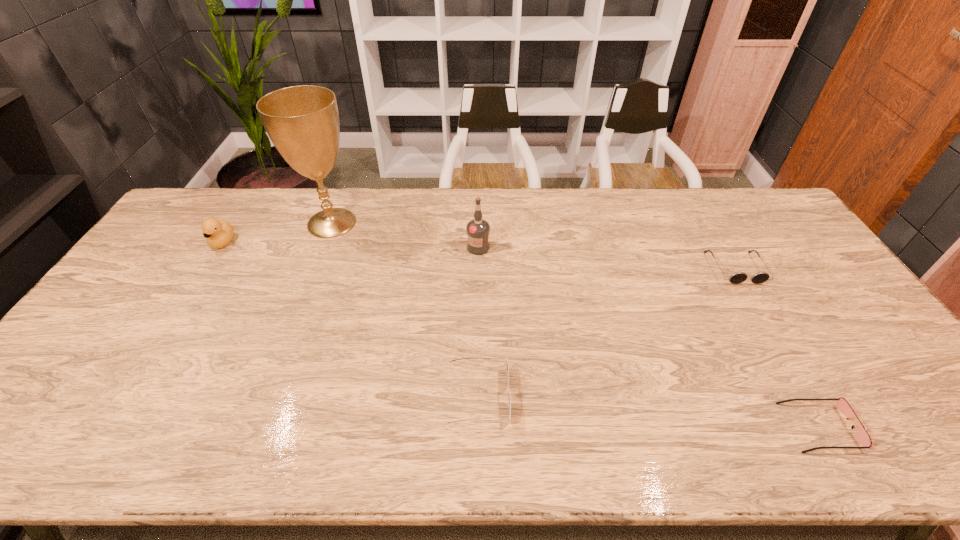
Where is `free spot between the leftmost sunglasses and the fifth object from right to left`? The height and width of the screenshot is (540, 960). free spot between the leftmost sunglasses and the fifth object from right to left is located at coordinates (405, 309).

I want to click on object that is the third closest to the vodka, so click(x=738, y=277).

Identify which object is the fifth closest to the leftmost sunglasses. Please provide its 2D coordinates. Your answer should be formatted as a tuple, i.e. [(x, y)], where the tuple contains the x and y coordinates of a point satisfying the conditions above.

[(218, 234)]

Locate which sunglasses ranks in proximity to the leftmost sunglasses. Please provide its 2D coordinates. Your answer should be formatted as a tuple, i.e. [(x, y)], where the tuple contains the x and y coordinates of a point satisfying the conditions above.

[(842, 404)]

The width and height of the screenshot is (960, 540). In order to click on sunglasses that is the closest to the tallest object in this screenshot , I will do `click(508, 395)`.